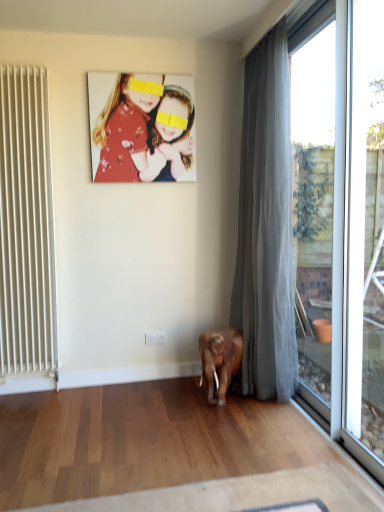
What are the coordinates of `vacant region below floral fabric photo at upper center (from a real-world perspective)` in the screenshot? It's located at (147, 375).